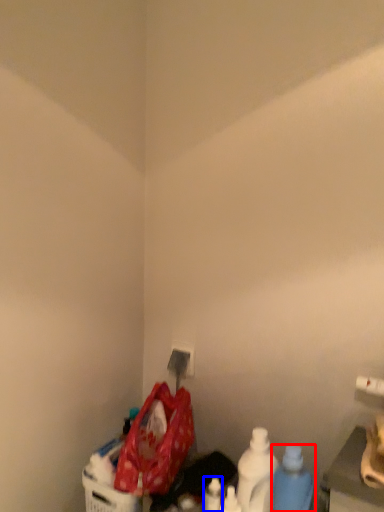
Question: Which object is further to the camera taking this photo, bottle (highlighted by a red box) or bottle (highlighted by a blue box)?

Choices:
 (A) bottle
 (B) bottle

Answer: (B)